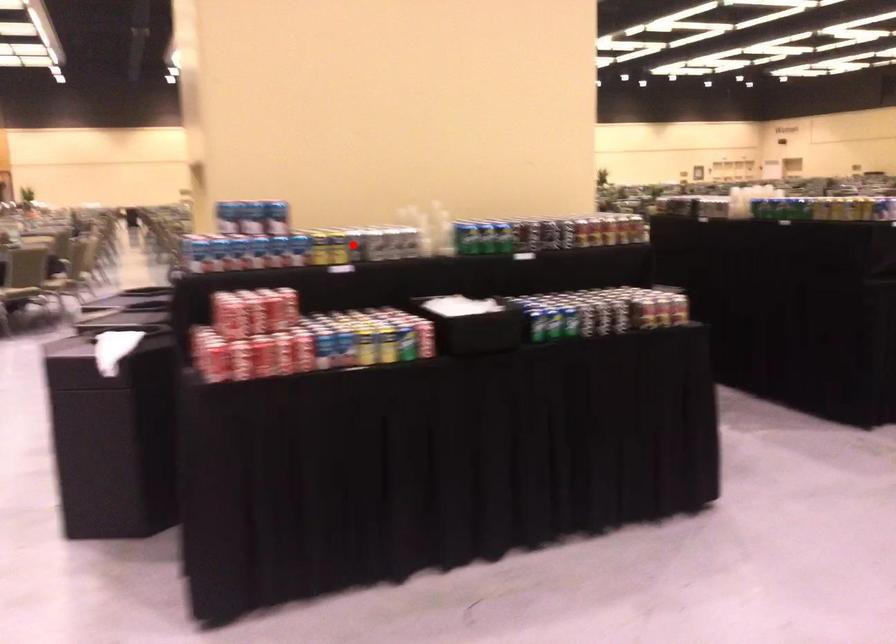
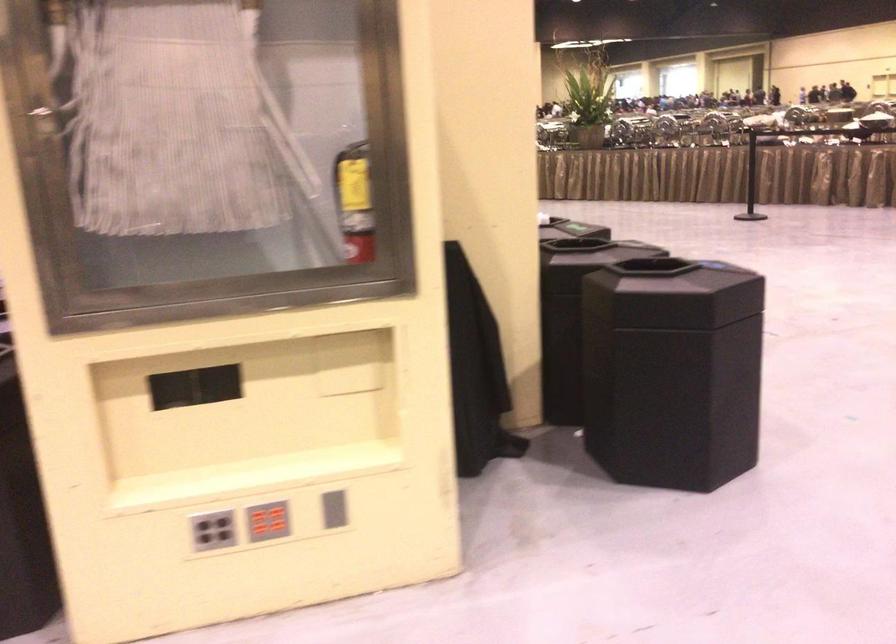
Question: I am providing you with two images of the same scene from different viewpoints. A red point is marked on the first image. Can you still see the location of the red point in image 2?

Choices:
 (A) Yes
 (B) No

Answer: (B)